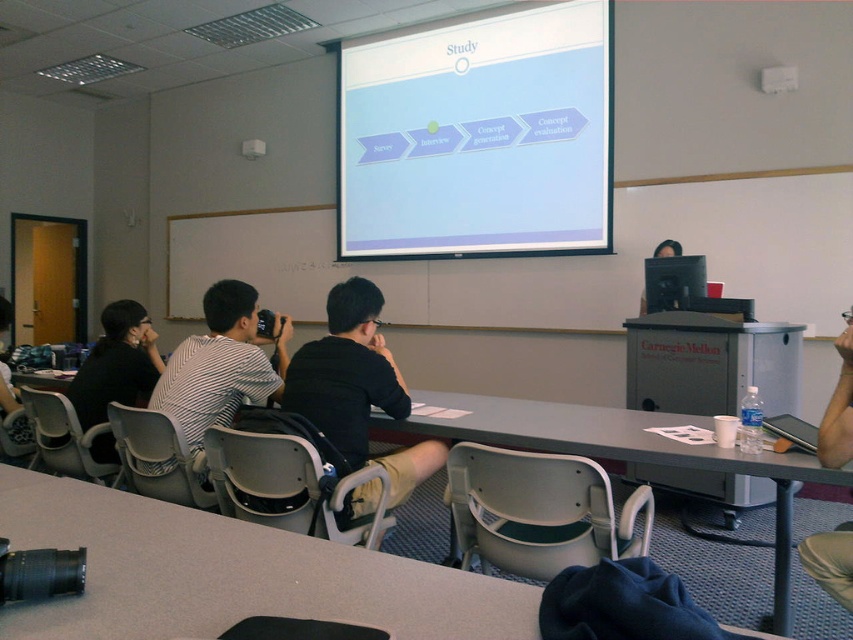
You are standing in the classroom and want to place a laptop on the smooth gray table at center. Your laptop is 12 inches wide. Can the table accommodate the laptop?

The smooth gray table at center is 32.68 inches from viewer. The distance from the viewer to the table does not indicate the table width. Therefore, it is unclear if the table can accommodate the laptop based on the given information.

You are a student in the classroom and need to present your project. The white glossy projector screen at upper center and the smooth gray table at center are both in front of you. Which object is bigger?

The white glossy projector screen at upper center is larger in size than the smooth gray table at center.

Consider the image. You are standing in the classroom facing the projector screen. You see two points marked on the screen at coordinates point (202, 300) and point (88, 385). Which point is closer to the front of the classroom?

Point (88, 385) is closer to the front of the classroom because it is closer to the viewer, while point (202, 300) is further away.